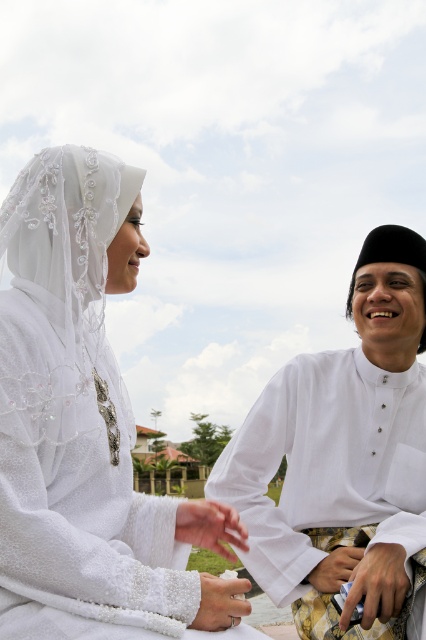
You are attending a wedding ceremony and notice the silver metallic ring at center. Based on its position, can you determine if it is closer to the person on the left or the right?

The silver metallic ring at center is located at point (221, 602), which places it closer to the person on the right.

You are a photographer capturing this wedding scene. You notice the silver metallic ring at center and the white satin hand at lower right. Which object is closer to the camera lens?

The silver metallic ring at center is closer to the camera lens because it is positioned in front of the white satin hand at lower right.